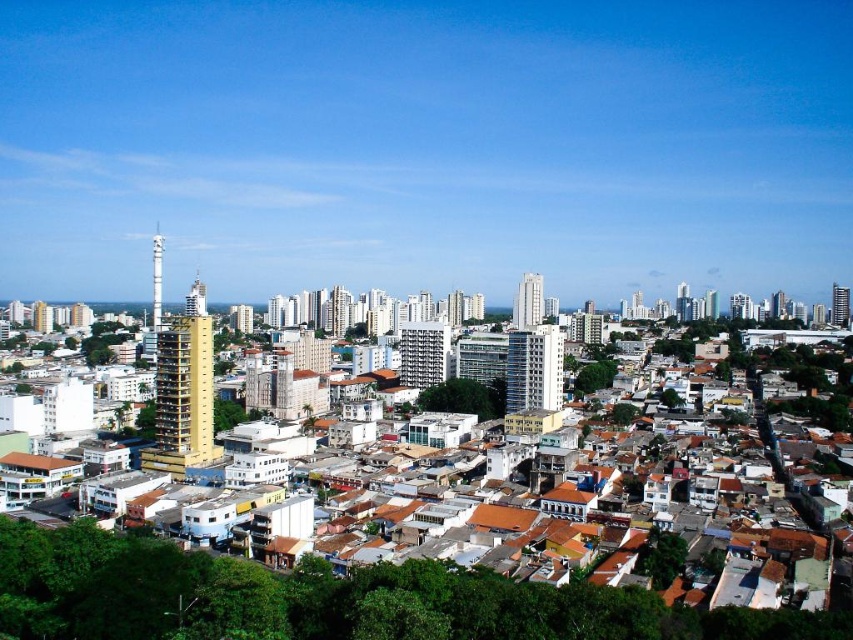
You are a drone operator who needs to fly a drone from the glassy metallic building at center to the gold glass skyscraper at right. Considering their positions, which building is closer to your current position?

The glassy metallic building at center is closer to your current position because it is in front of the gold glass skyscraper at right.

You are an architect analyzing the city layout. You notice the white glass building at center and the smooth glass skyscraper at center. Which one is located to the right of the other?

The white glass building at center is positioned on the right side of smooth glass skyscraper at center.

Based on the photo, you are an urban planner analyzing the city layout. Based on the image, which of the two buildings, the glassy metallic building at center or the white glass building at center, is shorter?

The glassy metallic building at center is shorter than the white glass building at center.